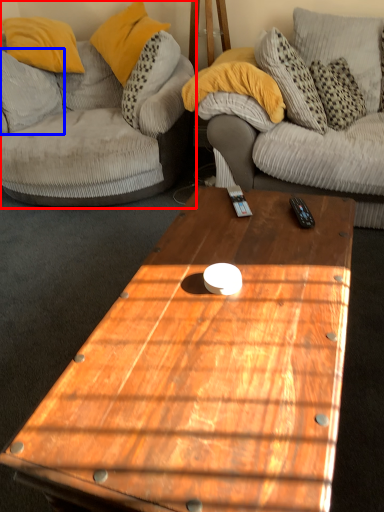
Question: Among these objects, which one is farthest to the camera, studio couch (highlighted by a red box) or pillow (highlighted by a blue box)?

Choices:
 (A) studio couch
 (B) pillow

Answer: (B)